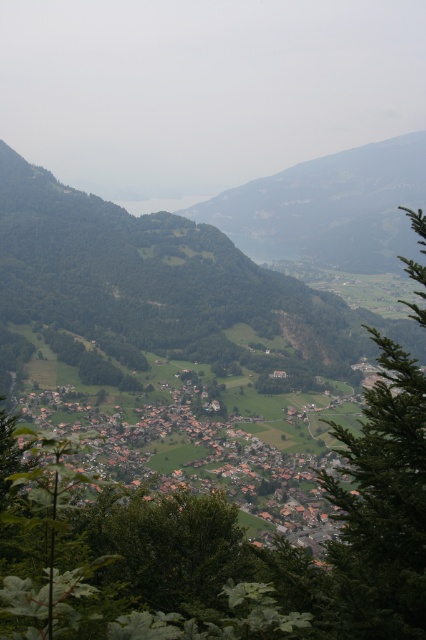
Question: Is green leafy tree at center-right thinner than brown tiled roofs at center?

Choices:
 (A) no
 (B) yes

Answer: (B)

Question: Is brown tiled roofs at center bigger than rocky cliff at center?

Choices:
 (A) no
 (B) yes

Answer: (A)

Question: Among these objects, which one is nearest to the camera?

Choices:
 (A) green leafy tree at center-right
 (B) brown tiled roofs at center
 (C) rocky cliff at center

Answer: (A)

Question: Which of these objects is positioned farthest from the brown tiled roofs at center?

Choices:
 (A) rocky cliff at center
 (B) green leafy tree at center-right

Answer: (A)

Question: Among these objects, which one is nearest to the camera?

Choices:
 (A) rocky cliff at center
 (B) brown tiled roofs at center
 (C) green leafy tree at center-right

Answer: (C)

Question: Considering the relative positions of green leafy tree at center-right and rocky cliff at center in the image provided, where is green leafy tree at center-right located with respect to rocky cliff at center?

Choices:
 (A) below
 (B) above

Answer: (A)